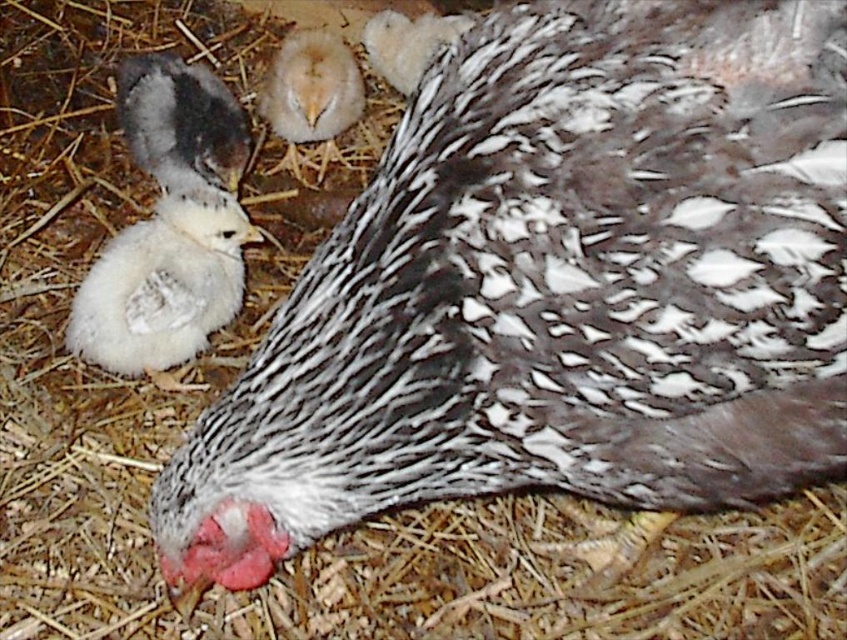
Is light yellow down at center further to the viewer compared to speckled feathered chicken at center?

No, it is not.

Which is above, light yellow down at center or speckled feathered chicken at center?

speckled feathered chicken at center is higher up.

Is point (320, 109) positioned behind point (430, 58)?

No, it is not.

Identify the location of light yellow down at center. The image size is (847, 640). point(311,88).

Between white fluffy chick at left and light yellow down at center, which one appears on the right side from the viewer's perspective?

light yellow down at center

Does white fluffy chick at left appear on the left side of light yellow down at center?

Yes, white fluffy chick at left is to the left of light yellow down at center.

Is point (154, 266) positioned before point (336, 81)?

Yes, it is in front of point (336, 81).

Identify the location of white fluffy chick at left. (169, 225).

Does white fluffy chick at left have a lesser width compared to speckled feathered chicken at center?

No.

Between white fluffy chick at left and speckled feathered chicken at center, which one has less height?

speckled feathered chicken at center is shorter.

Identify the location of white fluffy chick at left. The image size is (847, 640). (169, 225).